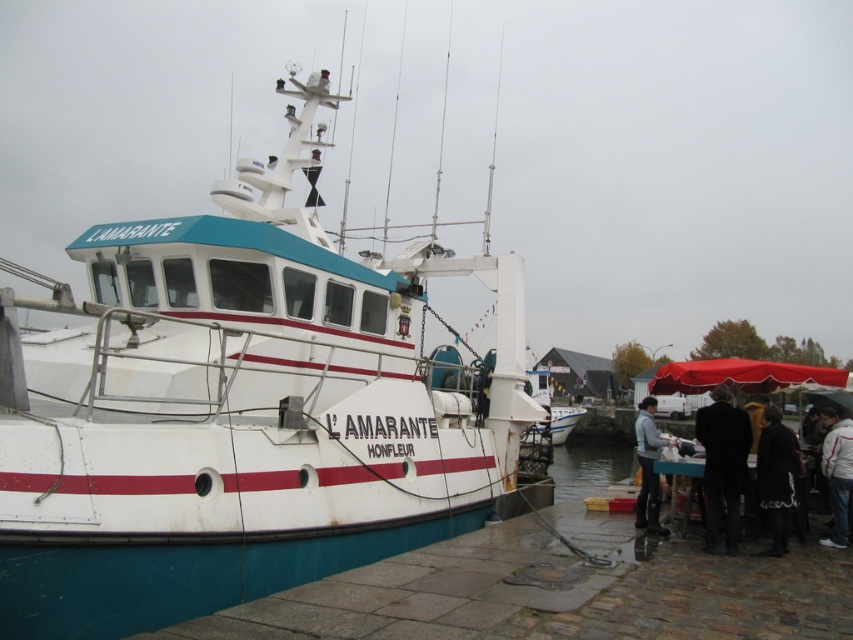
Question: Can you confirm if white matte boat at center is thinner than white fabric jacket at lower right?

Choices:
 (A) yes
 (B) no

Answer: (B)

Question: Can you confirm if white matte boat at center is thinner than white fabric jacket at lower right?

Choices:
 (A) no
 (B) yes

Answer: (A)

Question: Among these points, which one is farthest from the camera?

Choices:
 (A) (781, 433)
 (B) (706, 410)
 (C) (834, 461)
 (D) (648, 406)

Answer: (D)

Question: Which point is closer to the camera?

Choices:
 (A) dark gray wool coat at lower right
 (B) white matte boat at center
 (C) white fabric jacket at lower right

Answer: (B)

Question: Can you confirm if black wool coat at lower right is positioned to the right of white fabric jacket at lower right?

Choices:
 (A) no
 (B) yes

Answer: (A)

Question: Which point appears closest to the camera in this image?

Choices:
 (A) (637, 452)
 (B) (700, 428)
 (C) (773, 426)

Answer: (B)